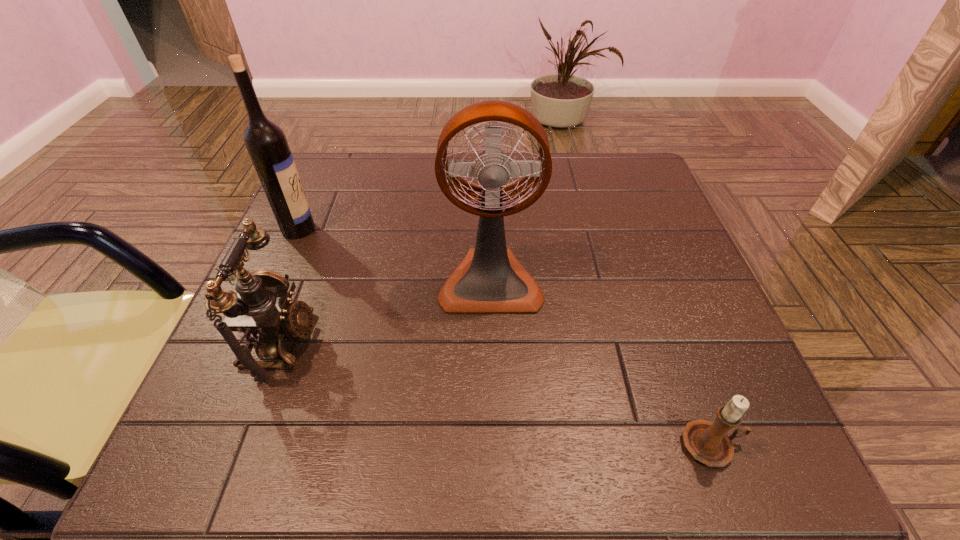
Locate an element on the screen. free point that satisfies the following two spatial constraints: 1. on the front-facing side of the third object from left to right; 2. on the rotary dial of the second shortest object is located at coordinates (492, 343).

The width and height of the screenshot is (960, 540). I want to click on free point that satisfies the following two spatial constraints: 1. on the front-facing side of the fan; 2. on the rotary dial of the third tallest object, so click(492, 343).